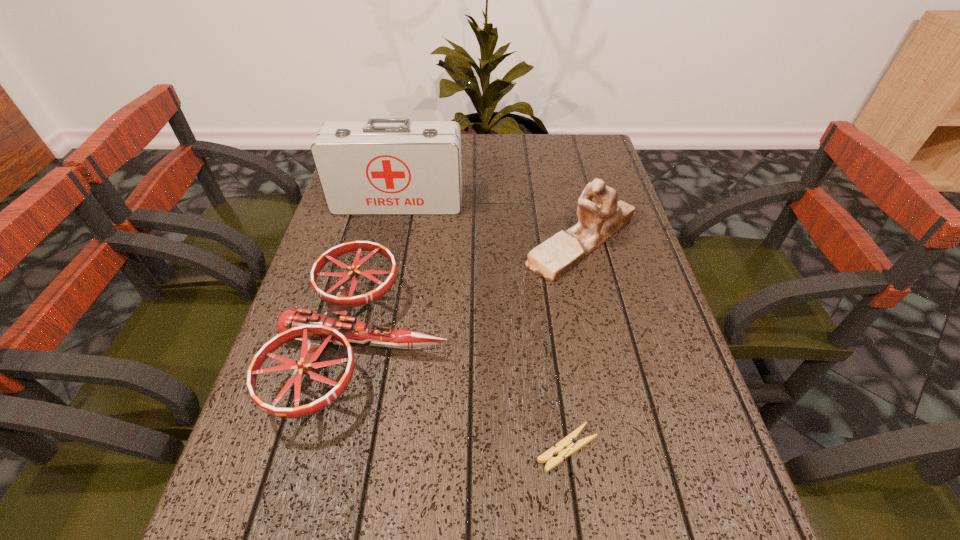
The image size is (960, 540). Find the location of `vacant space in between the drone and the third shortest object`. vacant space in between the drone and the third shortest object is located at coordinates pos(473,292).

Identify the location of free space between the drone and the shortest object. 467,395.

Locate an element on the screen. The image size is (960, 540). vacant space in between the first-aid kit and the clothespin is located at coordinates (483, 326).

In order to click on vacant area that lies between the first-aid kit and the figurine in this screenshot , I will do `click(490, 222)`.

I want to click on empty location between the shortest object and the third shortest object, so click(574, 346).

Find the location of a particular element. This screenshot has height=540, width=960. free space between the first-aid kit and the clothespin is located at coordinates (483, 326).

Identify which object is the closest to the first-aid kit. Please provide its 2D coordinates. Your answer should be formatted as a tuple, i.e. [(x, y)], where the tuple contains the x and y coordinates of a point satisfying the conditions above.

[(600, 216)]

Choose which object is the second nearest neighbor to the figurine. Please provide its 2D coordinates. Your answer should be formatted as a tuple, i.e. [(x, y)], where the tuple contains the x and y coordinates of a point satisfying the conditions above.

[(315, 330)]

At what (x,y) coordinates should I click in order to perform the action: click on free space that satisfies the following two spatial constraints: 1. on the front-facing side of the figurine; 2. on the front side of the second shortest object. Please return your answer as a coordinate pair (x, y). The height and width of the screenshot is (540, 960). Looking at the image, I should click on (605, 341).

Identify the location of vacant region that satisfies the following two spatial constraints: 1. on the front-facing side of the shortest object; 2. on the right side of the tallest object. (346, 449).